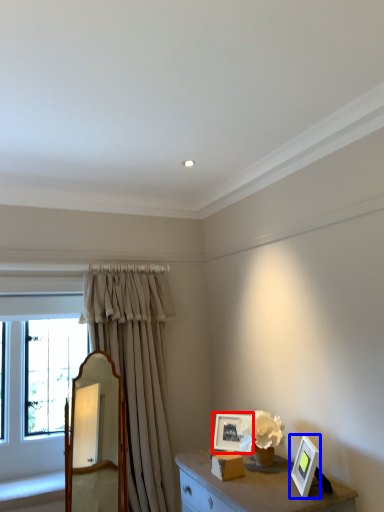
Question: Which of the following is the closest to the observer, picture frame (highlighted by a red box) or picture frame (highlighted by a blue box)?

Choices:
 (A) picture frame
 (B) picture frame

Answer: (B)